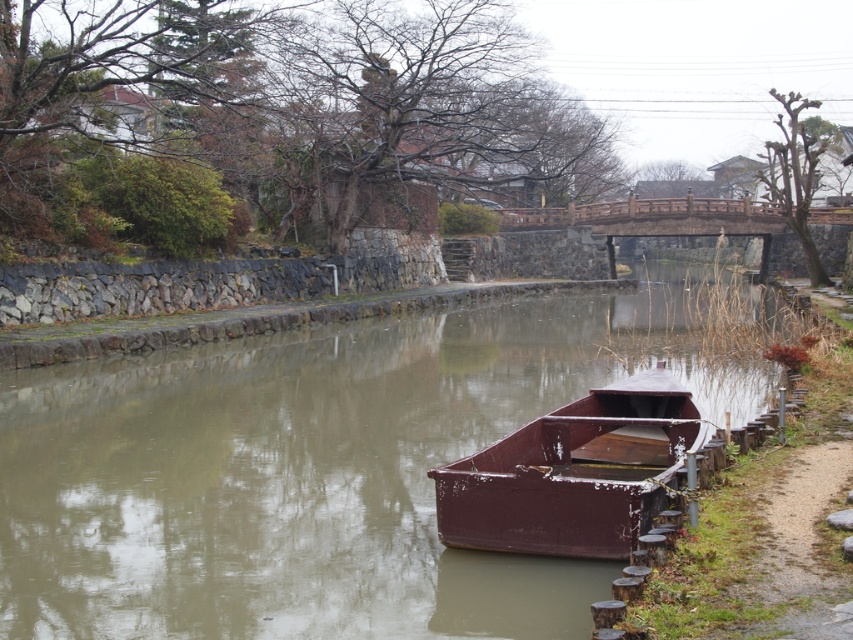
You are standing at the camera position and want to reach the point marked at coordinates (299, 595). The wooden boat is in your way. Can you walk around the boat to reach the point without getting into the water?

The point marked at coordinates (299, 595) is 9.03 meters away from the camera. Since the wooden boat is partially submerged at the edge of the canal, you can walk around it along the stone wall on the left side to reach the point without entering the water.

You are standing on the paved walkway on the left side of the canal and want to see both the smooth brown water at center and the rusty metal boat at center. Which object is higher from your viewpoint?

The smooth brown water at center is above the rusty metal boat at center, so the smooth brown water at center is higher from your viewpoint.

You are standing on the walkway next to the canal and want to place a small wooden box on the smooth brown water at center so that it floats. However, you need to ensure it doesn not drift away from the rusty metal boat at center. Based on the scene, where should you place the box relative to the boat?

The smooth brown water at center is positioned on the right side of the rusty metal boat at center. To prevent the box from drifting away, place it on the right side of the boat where the water is located.